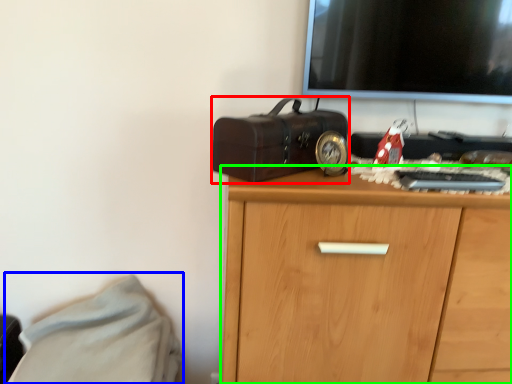
Question: Estimate the real-world distances between objects in this image. Which object is farther from suitcase (highlighted by a red box), bed (highlighted by a blue box) or chest of drawers (highlighted by a green box)?

Choices:
 (A) bed
 (B) chest of drawers

Answer: (A)